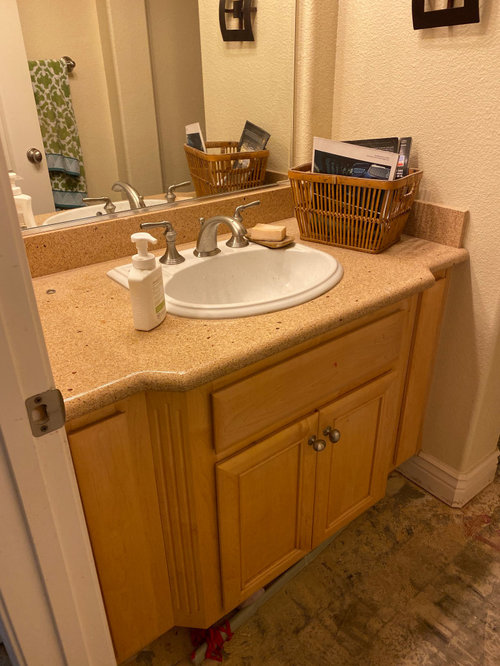
Image resolution: width=500 pixels, height=666 pixels. What are the coordinates of `sink` in the screenshot? It's located at pyautogui.click(x=242, y=272).